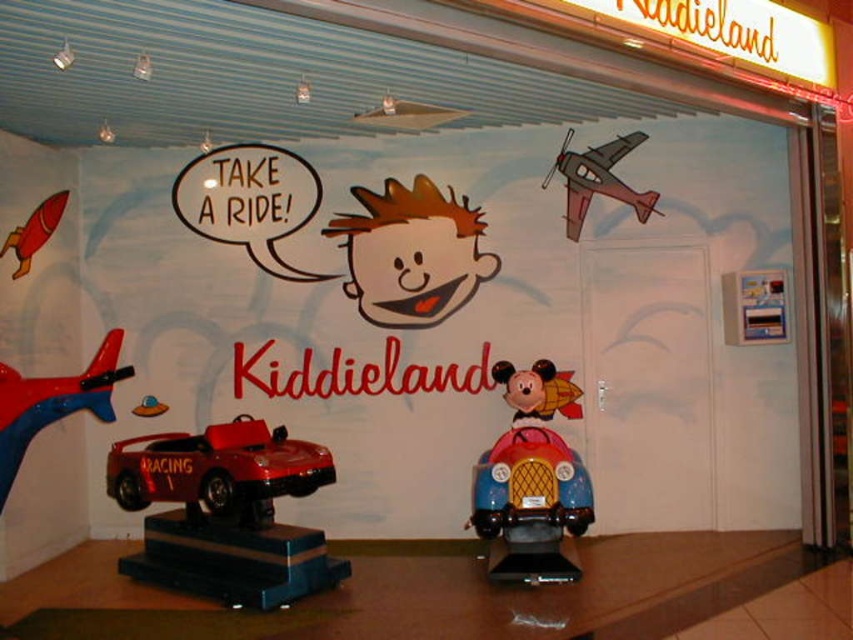
Question: Can you confirm if metallic red car at lower left is thinner than shiny red rocket at left?

Choices:
 (A) yes
 (B) no

Answer: (B)

Question: Which object appears closest to the camera in this image?

Choices:
 (A) white matte door at center
 (B) shiny red car at left
 (C) shiny red rocket at left

Answer: (B)

Question: Which object is the farthest from the shiny red car at left?

Choices:
 (A) metallic red car at lower left
 (B) shiny red rocket at left

Answer: (B)

Question: Which point appears closest to the camera in this image?

Choices:
 (A) (657, 198)
 (B) (117, 378)
 (C) (280, 540)

Answer: (B)

Question: Is metallic gray airplane at upper right positioned behind shiny red rocket at left?

Choices:
 (A) yes
 (B) no

Answer: (A)

Question: Is white matte door at center below shiny red rocket at left?

Choices:
 (A) yes
 (B) no

Answer: (A)